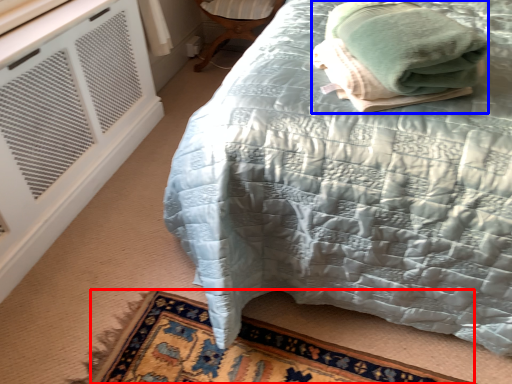
Question: Which point is closer to the camera, mat (highlighted by a red box) or bath towel (highlighted by a blue box)?

Choices:
 (A) mat
 (B) bath towel

Answer: (B)